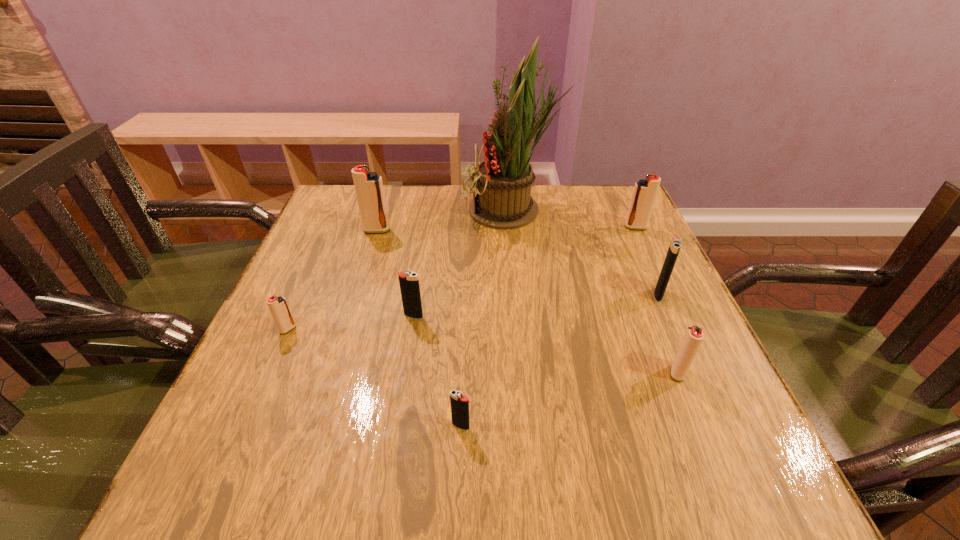
The height and width of the screenshot is (540, 960). Identify the location of vacant position in the image that satisfies the following two spatial constraints: 1. in front of the flower arrangement with the fan visible; 2. on the left side of the rightmost red igniter. (514, 227).

This screenshot has width=960, height=540. Find the location of `blank area in the image that satisfies the following two spatial constraints: 1. in front of the tallest object with the fan visible; 2. on the right side of the rightmost black igniter`. blank area in the image that satisfies the following two spatial constraints: 1. in front of the tallest object with the fan visible; 2. on the right side of the rightmost black igniter is located at coordinates (520, 294).

This screenshot has width=960, height=540. What are the coordinates of `blank area in the image that satisfies the following two spatial constraints: 1. in front of the seventh farthest object with the fan visible; 2. on the right side of the tallest object` in the screenshot? It's located at (528, 373).